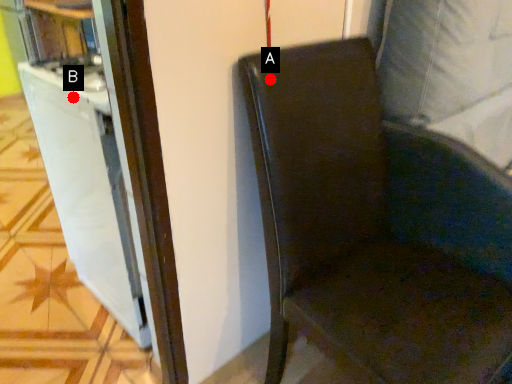
Question: Two points are circled on the image, labeled by A and B beside each circle. Which point is further to the camera?

Choices:
 (A) A is further
 (B) B is further

Answer: (B)